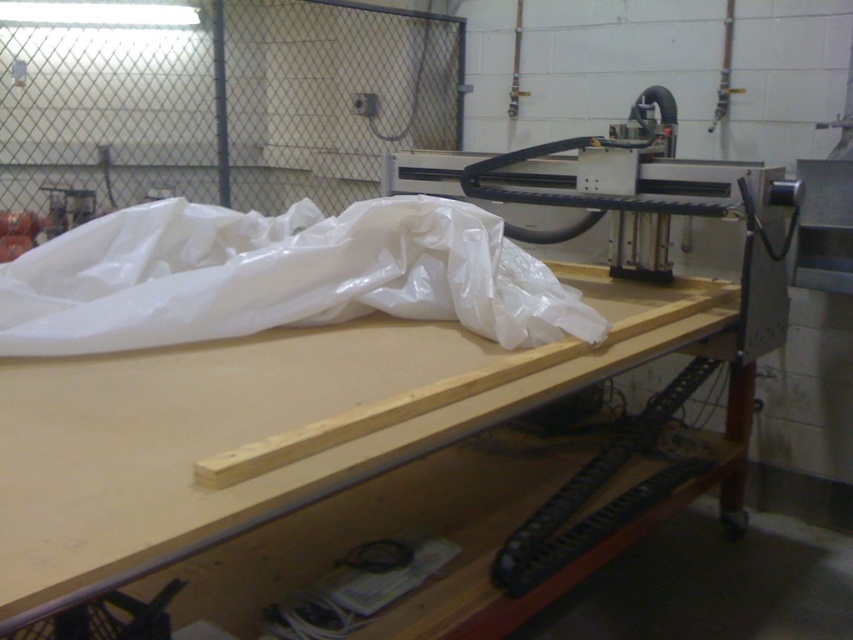
Question: Can you confirm if white plastic bag at center is wider than black plastic track at lower center?

Choices:
 (A) no
 (B) yes

Answer: (B)

Question: Which object is positioned farthest from the black plastic track at lower center?

Choices:
 (A) white plastic bag at center
 (B) light brown wood at center

Answer: (A)

Question: Estimate the real-world distances between objects in this image. Which object is closer to the white plastic bag at center?

Choices:
 (A) light brown wood at center
 (B) black plastic track at lower center

Answer: (A)

Question: Can you confirm if light brown wood at center is bigger than white plastic bag at center?

Choices:
 (A) yes
 (B) no

Answer: (A)

Question: Is light brown wood at center above black plastic track at lower center?

Choices:
 (A) no
 (B) yes

Answer: (B)

Question: Which of the following is the farthest from the observer?

Choices:
 (A) light brown wood at center
 (B) white plastic bag at center

Answer: (B)